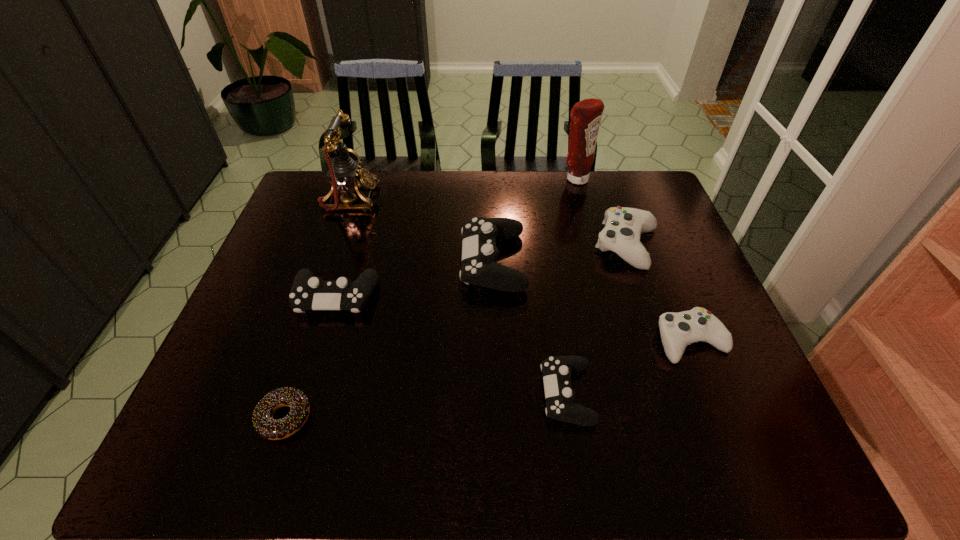
Locate an element on the screen. The image size is (960, 540). chocolate doughnut is located at coordinates (264, 424).

Where is `doughnut`? The width and height of the screenshot is (960, 540). doughnut is located at coordinates (264, 424).

You are a GUI agent. You are given a task and a screenshot of the screen. Output one action in this format:
    pyautogui.click(x=<x>, y=<y>)
    Task: Click on the free point located on the left of the red condiment
    
    Given the screenshot: What is the action you would take?
    pyautogui.click(x=540, y=179)

The height and width of the screenshot is (540, 960). Identify the location of free space located 0.230m on the front of the telephone, featuring the rotary dial. (446, 199).

You are a GUI agent. You are given a task and a screenshot of the screen. Output one action in this format:
    pyautogui.click(x=<x>, y=<y>)
    Task: Click on the free space located on the surface of the fourth object from left to right
    
    Given the screenshot: What is the action you would take?
    pyautogui.click(x=429, y=261)

The height and width of the screenshot is (540, 960). In order to click on blank space located 0.160m on the surface of the fourth object from left to right in this screenshot , I will do `click(404, 261)`.

What are the coordinates of `blank area located 0.170m on the surface of the fourth object from left to right` in the screenshot? It's located at (400, 261).

Image resolution: width=960 pixels, height=540 pixels. I want to click on vacant space located on the front of the bigger white control, so click(646, 300).

What are the coordinates of `vacant area located on the surface of the leftmost control` in the screenshot? It's located at (318, 355).

Image resolution: width=960 pixels, height=540 pixels. I want to click on free space located 0.230m on the front of the smaller white control, so click(x=742, y=468).